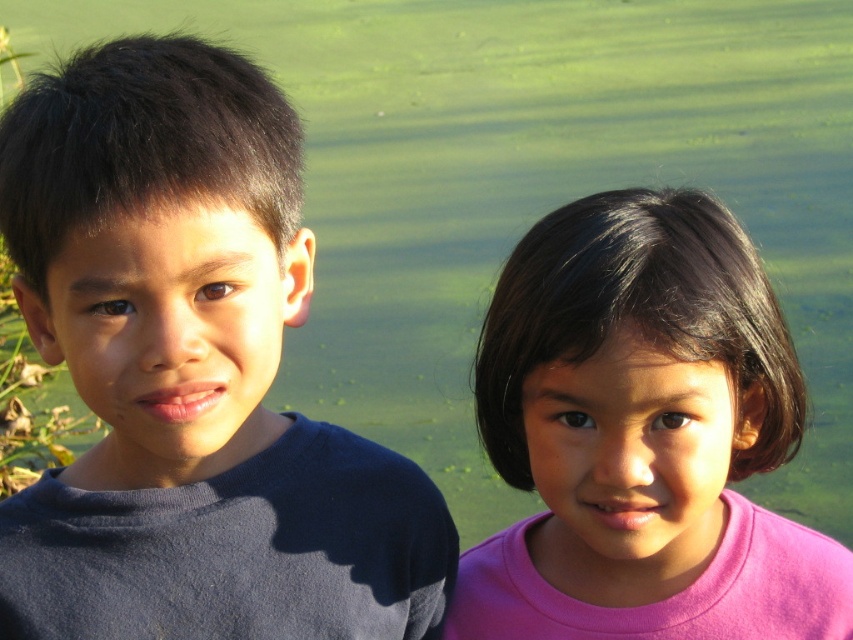
Question: Does dark blue shirt at left have a smaller size compared to pink matte shirt at right?

Choices:
 (A) yes
 (B) no

Answer: (B)

Question: Is dark blue shirt at left below pink matte shirt at right?

Choices:
 (A) yes
 (B) no

Answer: (B)

Question: Among these points, which one is farthest from the camera?

Choices:
 (A) (538, 353)
 (B) (206, 358)

Answer: (A)

Question: Does dark blue shirt at left appear on the left side of pink matte shirt at right?

Choices:
 (A) no
 (B) yes

Answer: (B)

Question: Which point is closer to the camera?

Choices:
 (A) (141, 440)
 (B) (602, 384)

Answer: (A)